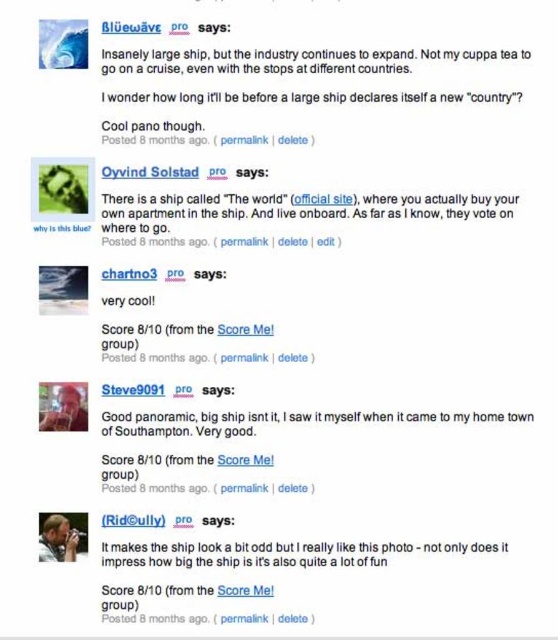
Which is behind, point (209, 554) or point (401, 412)?

The point (401, 412) is more distant.

Is point (138, 547) farther from viewer compared to point (166, 422)?

That is False.

Between point (276, 552) and point (499, 417), which one is positioned behind?

The point (276, 552) is behind.

The width and height of the screenshot is (558, 640). In order to click on matte black ship at center in this screenshot , I will do pos(276,552).

Does point (165, 243) come behind point (233, 563)?

Yes, it is.

Can you confirm if white glossy text at center is wider than matte black ship at center?

Yes, white glossy text at center is wider than matte black ship at center.

Image resolution: width=558 pixels, height=640 pixels. I want to click on white glossy text at center, so click(276, 212).

At what (x,y) coordinates should I click in order to perform the action: click on white glossy text at center. Please return your answer as a coordinate pair (x, y). The image size is (558, 640). Looking at the image, I should click on tap(276, 212).

Can you confirm if white glossy text at center is wider than good panoramic big ship at center?

No.

Which is behind, point (140, 243) or point (209, 419)?

The point (209, 419) is more distant.

In order to click on white glossy text at center in this screenshot , I will do point(276,212).